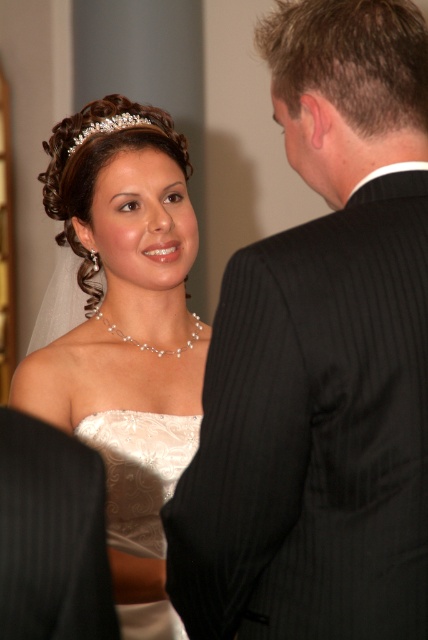
You are a photographer at the wedding and want to capture a photo of both the bride and the groom. The bride is standing at point (38, 384) and the groom is at point (136, 120). Since the photographer is behind the groom, will the bride block the groom in the photo?

Point (38, 384) is in front of point (136, 120), so the bride at point (38, 384) will block the groom at point (136, 120) in the photo.

You are a photographer at a wedding and need to adjust the camera focus. The white satin dress at center and the clear crystal tiara at upper center are both in the frame. Which object is taller and requires more focus adjustment for depth of field?

The white satin dress at center has a greater height compared to the clear crystal tiara at upper center, so it requires more focus adjustment for depth of field due to its larger size.